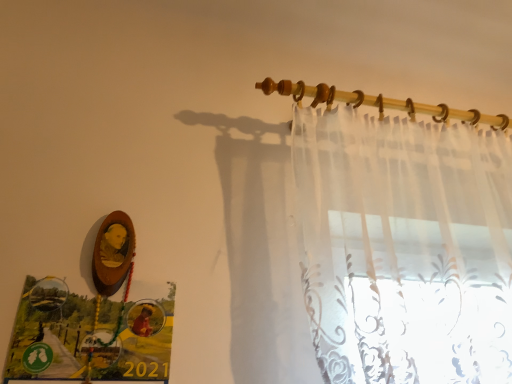
Question: Would you say translucent fabric at upper center is to the left or to the right of sheer white curtain at upper right in the picture?

Choices:
 (A) left
 (B) right

Answer: (A)

Question: Looking at their shapes, would you say translucent fabric at upper center is wider or thinner than sheer white curtain at upper right?

Choices:
 (A) thin
 (B) wide

Answer: (A)

Question: Considering the positions of translucent fabric at upper center and sheer white curtain at upper right in the image, is translucent fabric at upper center taller or shorter than sheer white curtain at upper right?

Choices:
 (A) tall
 (B) short

Answer: (B)

Question: Is sheer white curtain at upper right taller or shorter than translucent fabric at upper center?

Choices:
 (A) tall
 (B) short

Answer: (A)

Question: From the image's perspective, is sheer white curtain at upper right above or below translucent fabric at upper center?

Choices:
 (A) below
 (B) above

Answer: (A)

Question: Based on their sizes in the image, would you say sheer white curtain at upper right is bigger or smaller than translucent fabric at upper center?

Choices:
 (A) big
 (B) small

Answer: (A)

Question: Considering the positions of sheer white curtain at upper right and translucent fabric at upper center in the image, is sheer white curtain at upper right wider or thinner than translucent fabric at upper center?

Choices:
 (A) thin
 (B) wide

Answer: (B)